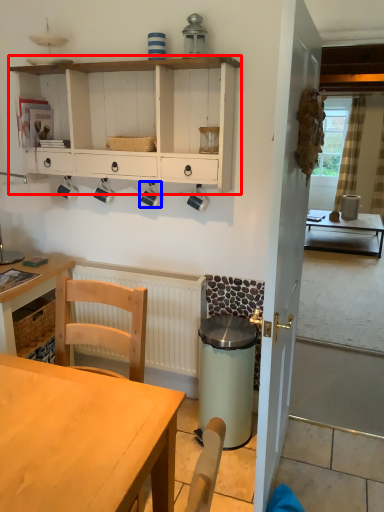
Question: Which object is further to the camera taking this photo, cabinetry (highlighted by a red box) or coffee cup (highlighted by a blue box)?

Choices:
 (A) cabinetry
 (B) coffee cup

Answer: (B)